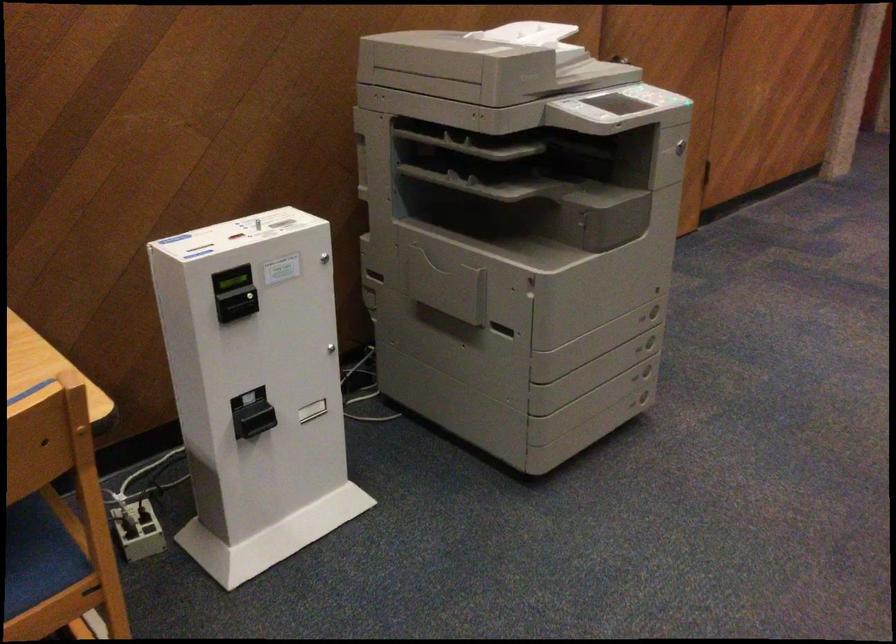
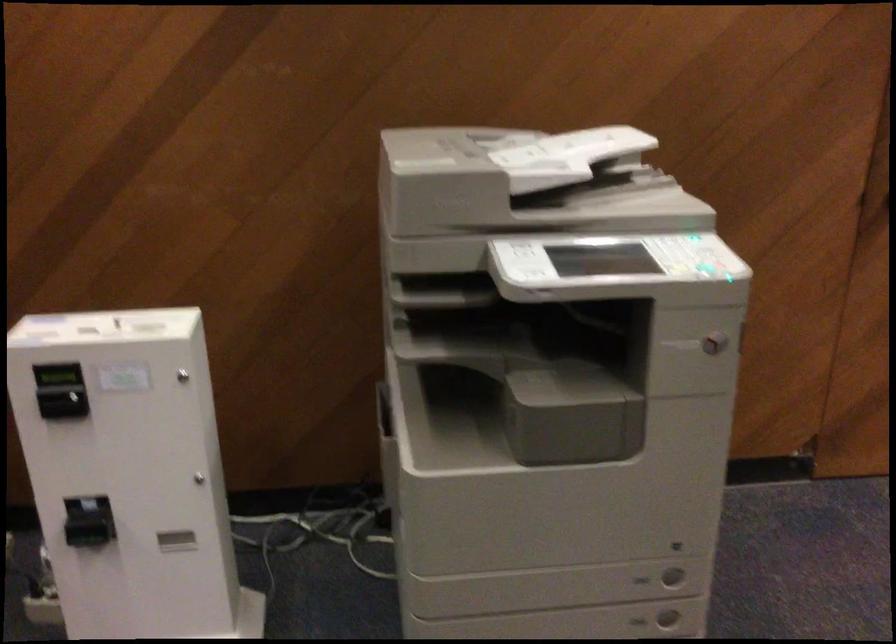
The point at (x=643, y=351) is marked in the first image. Where is the corresponding point in the second image?

(638, 621)